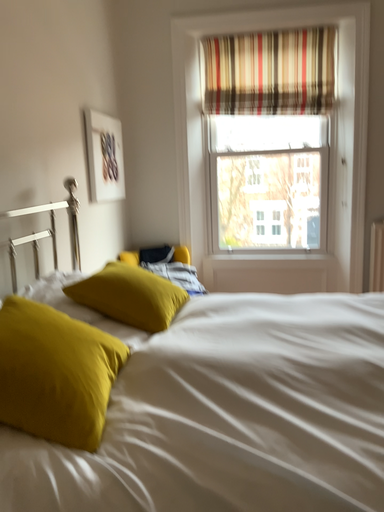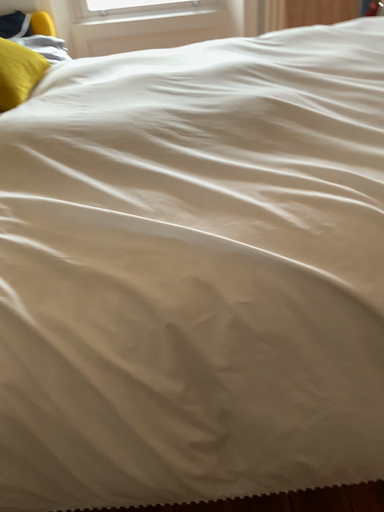
Question: How did the camera likely rotate when shooting the video?

Choices:
 (A) rotated upward
 (B) rotated downward

Answer: (B)